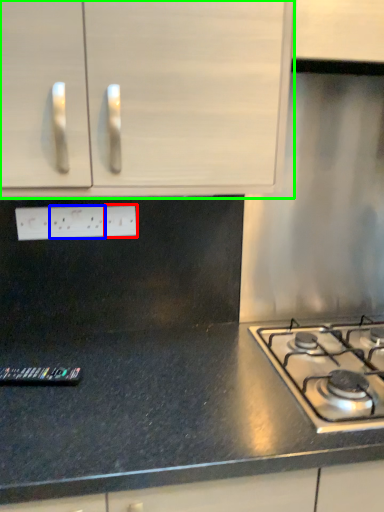
Question: Which is farther away from electric outlet (highlighted by a red box)? electric outlet (highlighted by a blue box) or cabinetry (highlighted by a green box)?

Choices:
 (A) electric outlet
 (B) cabinetry

Answer: (B)